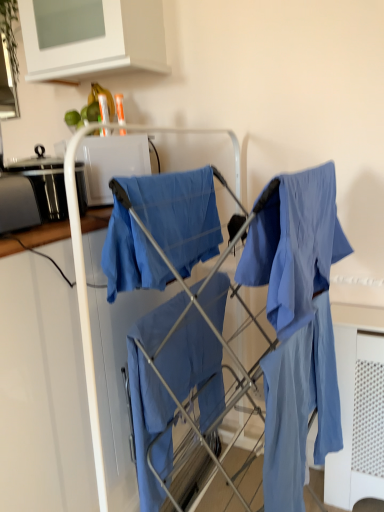
Question: Can you confirm if white matte cabinet at upper center is thinner than matte blue fabric at center, which appears as the first cloak when ordered from the bottom?

Choices:
 (A) yes
 (B) no

Answer: (B)

Question: Is white matte cabinet at upper center facing towards matte blue fabric at center, which is the 2th cloak from top to bottom?

Choices:
 (A) yes
 (B) no

Answer: (B)

Question: Is matte blue fabric at center, which appears as the first cloak when ordered from the bottom, at the back of white matte cabinet at upper center?

Choices:
 (A) no
 (B) yes

Answer: (A)

Question: From a real-world perspective, is white matte cabinet at upper center physically above matte blue fabric at center, which appears as the first cloak when ordered from the bottom?

Choices:
 (A) no
 (B) yes

Answer: (B)

Question: Are white matte cabinet at upper center and matte blue fabric at center, which appears as the first cloak when ordered from the bottom, far apart?

Choices:
 (A) no
 (B) yes

Answer: (B)

Question: Is matte blue fabric at center, which appears as the first cloak when ordered from the bottom, taller or shorter than white matte cabinet at upper center?

Choices:
 (A) short
 (B) tall

Answer: (B)

Question: Based on their positions, is matte blue fabric at center, which is the 2th cloak from top to bottom, located to the left or right of white matte cabinet at upper center?

Choices:
 (A) right
 (B) left

Answer: (A)

Question: Is matte blue fabric at center, which is the 2th cloak from top to bottom, in front of or behind white matte cabinet at upper center in the image?

Choices:
 (A) front
 (B) behind

Answer: (A)

Question: Looking at the image, does matte blue fabric at center, which appears as the first cloak when ordered from the bottom, seem bigger or smaller compared to white matte cabinet at upper center?

Choices:
 (A) big
 (B) small

Answer: (B)

Question: Considering the positions of blue cotton cloth at center, placed as the 2th cloak when sorted from bottom to top, and matte blue fabric at center, which appears as the first cloak when ordered from the bottom, in the image, is blue cotton cloth at center, placed as the 2th cloak when sorted from bottom to top, bigger or smaller than matte blue fabric at center, which appears as the first cloak when ordered from the bottom,?

Choices:
 (A) small
 (B) big

Answer: (A)

Question: From the image's perspective, is blue cotton cloth at center, placed as the 2th cloak when sorted from bottom to top, located above or below matte blue fabric at center, which appears as the first cloak when ordered from the bottom?

Choices:
 (A) above
 (B) below

Answer: (A)

Question: From a real-world perspective, is blue cotton cloth at center, placed as the first cloak when sorted from top to bottom, physically located above or below matte blue fabric at center, which appears as the first cloak when ordered from the bottom?

Choices:
 (A) above
 (B) below

Answer: (A)

Question: From their relative heights in the image, would you say blue cotton cloth at center, placed as the 2th cloak when sorted from bottom to top, is taller or shorter than matte blue fabric at center, which appears as the first cloak when ordered from the bottom?

Choices:
 (A) short
 (B) tall

Answer: (A)

Question: From the image's perspective, relative to white matte cabinet at upper center, is blue cotton cloth at center, placed as the first cloak when sorted from top to bottom, above or below?

Choices:
 (A) below
 (B) above

Answer: (A)

Question: In the image, is blue cotton cloth at center, placed as the first cloak when sorted from top to bottom, positioned in front of or behind white matte cabinet at upper center?

Choices:
 (A) behind
 (B) front

Answer: (B)